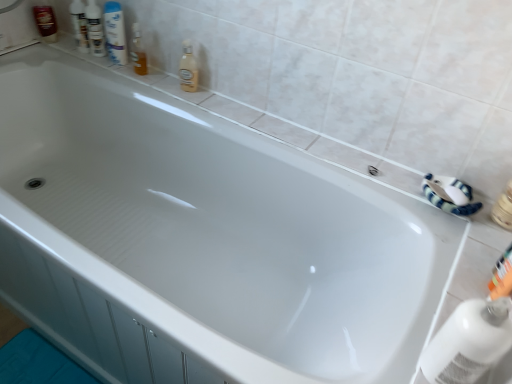
Question: Would you say translucent plastic soap dispenser at upper center, the second toiletry positioned from the right, is inside or outside orange plastic toothbrush at lower right, the 5th toiletry when ordered from back to front?

Choices:
 (A) inside
 (B) outside

Answer: (B)

Question: Is point [x=144, y=72] closer or farther from the camera than point [x=504, y=274]?

Choices:
 (A) farther
 (B) closer

Answer: (A)

Question: Which of these objects is positioned closest to the matte white pump bottle at upper left, the 3th toiletry positioned from the back?

Choices:
 (A) transparent plastic bottle at lower right, marked as the 2th cleaning product in a back-to-front arrangement
 (B) translucent plastic soap dispenser at upper center, positioned as the 4th toiletry in top-to-bottom order
 (C) white glossy mouthwash at upper left
 (D) orange plastic toothbrush at lower right, the 1th toiletry in the bottom-to-top sequence
 (E) translucent plastic bottle at upper center, the 2th cleaning product in the right-to-left sequence

Answer: (C)

Question: Which object is the closest to the orange plastic toothbrush at lower right, which is the 5th toiletry in top-to-bottom order?

Choices:
 (A) white glossy shampoo bottles at upper left, positioned as the second toiletry in left-to-right order
 (B) shiny brown bottle at upper left, the fifth toiletry viewed from the front
 (C) matte white pump bottle at upper left, acting as the 3th toiletry starting from the top
 (D) transparent plastic bottle at lower right, placed as the 1th cleaning product when sorted from right to left
 (E) translucent plastic bottle at upper center, which ranks as the second cleaning product in bottom-to-top order

Answer: (D)